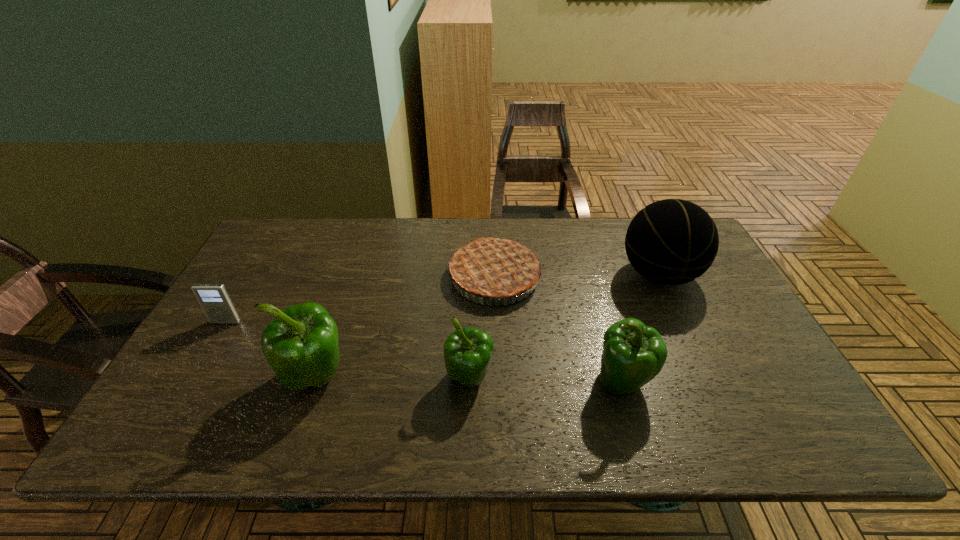
Find the location of a particular element. free location located on the back of the fifth object from left to right is located at coordinates (611, 340).

What are the coordinates of `free space located on the front-facing side of the leftmost object` in the screenshot? It's located at (179, 402).

This screenshot has width=960, height=540. I want to click on vacant region located on the left of the rightmost object, so click(592, 275).

Locate an element on the screen. vacant region located on the front of the pie is located at coordinates (496, 334).

At what (x,y) coordinates should I click in order to perform the action: click on basketball at the far edge. Please return your answer as a coordinate pair (x, y). Image resolution: width=960 pixels, height=540 pixels. Looking at the image, I should click on (670, 242).

You are a GUI agent. You are given a task and a screenshot of the screen. Output one action in this format:
    pyautogui.click(x=<x>, y=<y>)
    Task: Click on the pie located at the far edge
    
    Given the screenshot: What is the action you would take?
    pyautogui.click(x=492, y=268)

Where is `object that is at the left edge`? object that is at the left edge is located at coordinates (214, 299).

Where is `object present at the right edge`? Image resolution: width=960 pixels, height=540 pixels. object present at the right edge is located at coordinates (670, 242).

Find the location of a particular element. The height and width of the screenshot is (540, 960). object present at the far right corner is located at coordinates (670, 242).

This screenshot has height=540, width=960. In the image, there is a desktop. Identify the location of vacant area at the far edge. (334, 228).